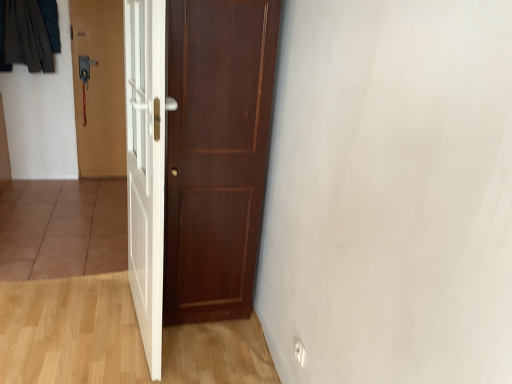
The width and height of the screenshot is (512, 384). What are the coordinates of `vacant area that is in front of wooden door at left, the first door viewed from the left` in the screenshot? It's located at (93, 185).